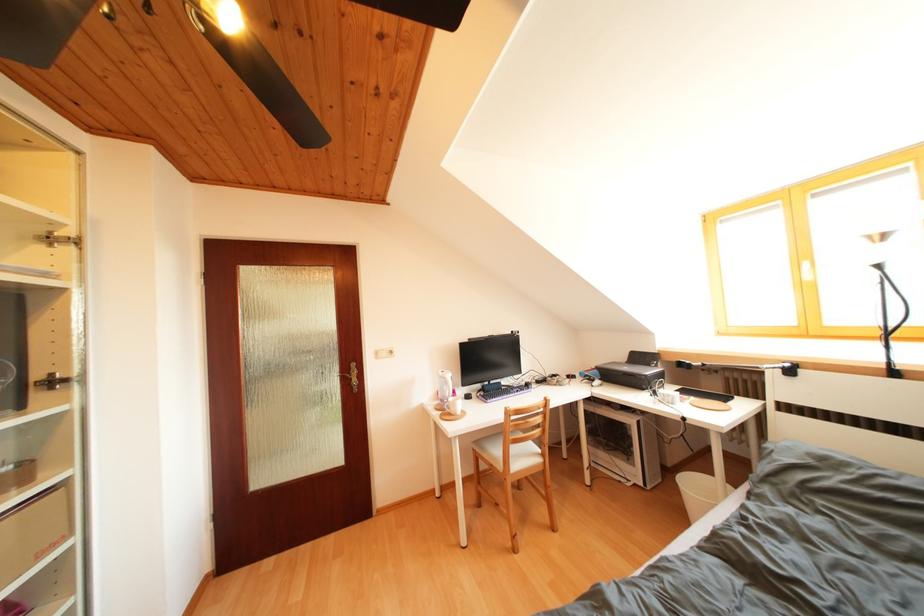
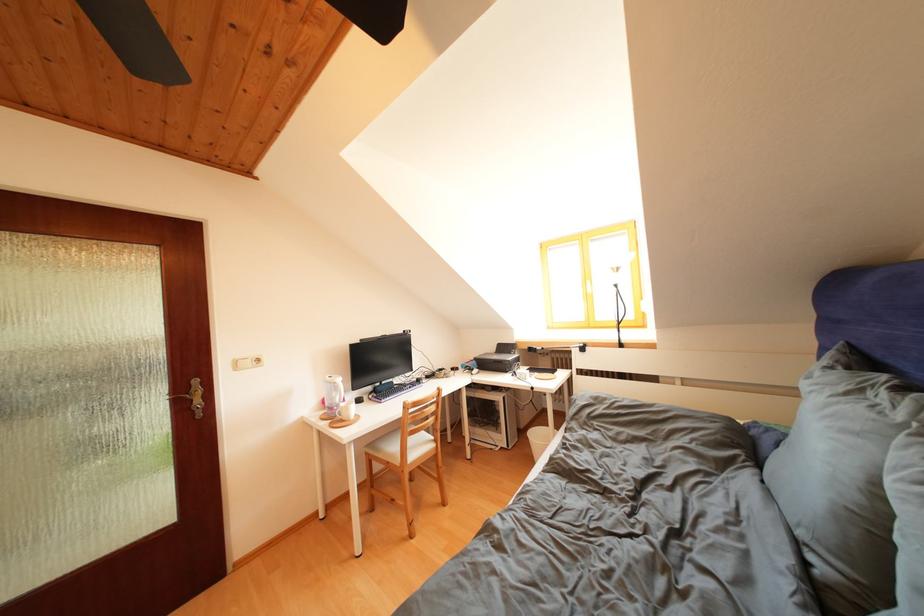
The point at (x=458, y=405) is marked in the first image. Where is the corresponding point in the second image?

(350, 410)